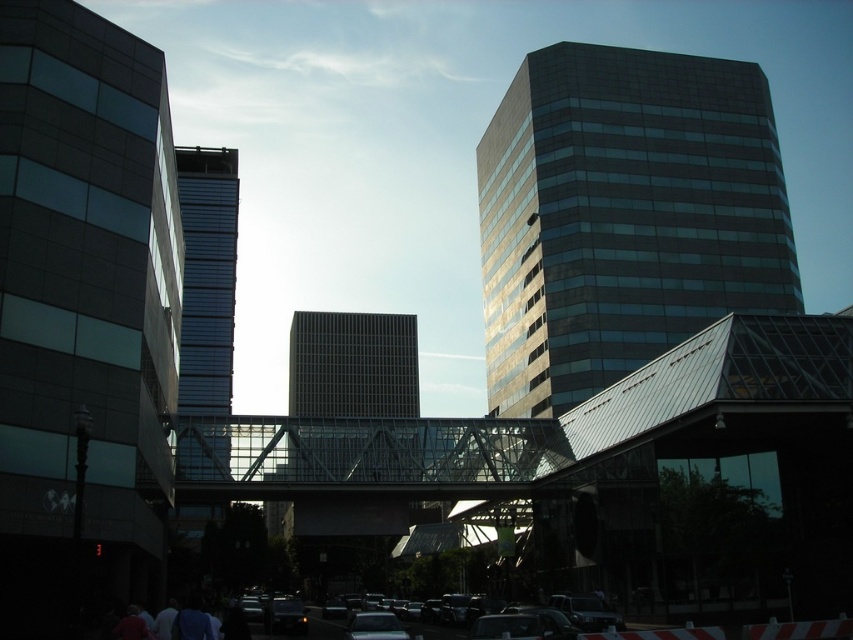
You are a pedestrian standing on the sidewalk and want to cross the street to reach the building on the other side. The transparent glass bridge at center and the shiny black car at lower center are in your path. Which object do you need to go under to avoid the traffic?

You need to go under the transparent glass bridge at center because it is above the shiny black car at lower center, allowing you to cross safely above the traffic.

You are a city planner analyzing the urban layout. Given the glassy reflective building at left and the shiny black car at center, which object occupies a larger area in the image?

The glassy reflective building at left is bigger than the shiny black car at center, so it occupies a larger area in the image.

You are a delivery person needing to cross the street between the glassy reflective building at left and the shiny black car at center. The road is 10 meters wide. Can you safely cross without stepping into the road?

The distance between the glassy reflective building at left and the shiny black car at center is 19.29 meters. Since the road is only 10 meters wide, you can safely cross between them without stepping into the road.